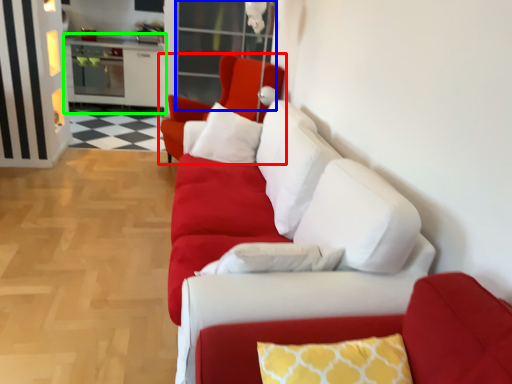
Question: Which object is the closest to the chair (highlighted by a red box)? Choose among these: glass door (highlighted by a blue box) or entertainment center (highlighted by a green box).

Choices:
 (A) glass door
 (B) entertainment center

Answer: (A)